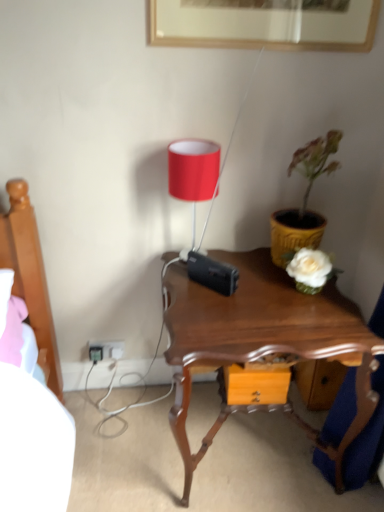
Question: Does white plastic electric outlet at lower left have a smaller size compared to mahogany wood nightstand at center?

Choices:
 (A) yes
 (B) no

Answer: (A)

Question: Is white plastic electric outlet at lower left to the right of mahogany wood nightstand at center from the viewer's perspective?

Choices:
 (A) no
 (B) yes

Answer: (A)

Question: Is white plastic electric outlet at lower left facing away from mahogany wood nightstand at center?

Choices:
 (A) yes
 (B) no

Answer: (B)

Question: Considering the relative sizes of white plastic electric outlet at lower left and mahogany wood nightstand at center in the image provided, is white plastic electric outlet at lower left wider than mahogany wood nightstand at center?

Choices:
 (A) no
 (B) yes

Answer: (A)

Question: Considering the relative sizes of white plastic electric outlet at lower left and mahogany wood nightstand at center in the image provided, is white plastic electric outlet at lower left taller than mahogany wood nightstand at center?

Choices:
 (A) yes
 (B) no

Answer: (B)

Question: From a real-world perspective, does white plastic electric outlet at lower left sit lower than mahogany wood nightstand at center?

Choices:
 (A) no
 (B) yes

Answer: (B)

Question: Is the surface of yellow textured pot at right in direct contact with mahogany wood nightstand at center?

Choices:
 (A) no
 (B) yes

Answer: (A)

Question: Does yellow textured pot at right appear on the left side of mahogany wood nightstand at center?

Choices:
 (A) yes
 (B) no

Answer: (B)

Question: From the image's perspective, is yellow textured pot at right located beneath mahogany wood nightstand at center?

Choices:
 (A) yes
 (B) no

Answer: (B)

Question: From the image's perspective, is yellow textured pot at right located above mahogany wood nightstand at center?

Choices:
 (A) yes
 (B) no

Answer: (A)

Question: Is yellow textured pot at right not near mahogany wood nightstand at center?

Choices:
 (A) yes
 (B) no

Answer: (B)

Question: From a real-world perspective, is yellow textured pot at right located beneath mahogany wood nightstand at center?

Choices:
 (A) no
 (B) yes

Answer: (A)

Question: Is the depth of black plastic plug at lower left less than that of mahogany wood nightstand at center?

Choices:
 (A) yes
 (B) no

Answer: (B)